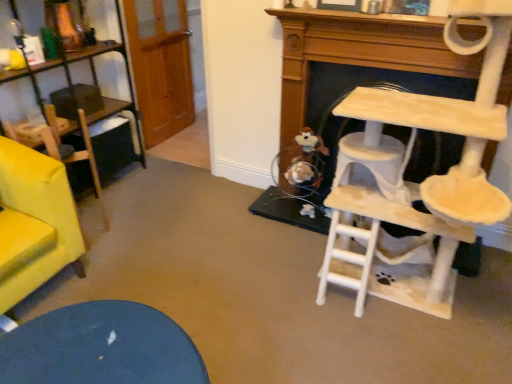
Question: Can you confirm if brown plush toy at lower center is taller than velvet yellow armchair at left?

Choices:
 (A) yes
 (B) no

Answer: (B)

Question: From a real-world perspective, is brown plush toy at lower center over velvet yellow armchair at left?

Choices:
 (A) no
 (B) yes

Answer: (B)

Question: Considering the relative positions of brown plush toy at lower center and velvet yellow armchair at left in the image provided, is brown plush toy at lower center to the right of velvet yellow armchair at left from the viewer's perspective?

Choices:
 (A) yes
 (B) no

Answer: (A)

Question: Is brown plush toy at lower center thinner than velvet yellow armchair at left?

Choices:
 (A) no
 (B) yes

Answer: (B)

Question: From the image's perspective, is brown plush toy at lower center located above velvet yellow armchair at left?

Choices:
 (A) yes
 (B) no

Answer: (A)

Question: Does brown plush toy at lower center come behind velvet yellow armchair at left?

Choices:
 (A) yes
 (B) no

Answer: (A)

Question: From the image's perspective, would you say beige wooden cat tree at right is shown under velvet yellow armchair at left?

Choices:
 (A) yes
 (B) no

Answer: (B)

Question: Considering the relative sizes of beige wooden cat tree at right and velvet yellow armchair at left in the image provided, is beige wooden cat tree at right shorter than velvet yellow armchair at left?

Choices:
 (A) no
 (B) yes

Answer: (A)

Question: Is beige wooden cat tree at right wider than velvet yellow armchair at left?

Choices:
 (A) no
 (B) yes

Answer: (B)

Question: Can velvet yellow armchair at left be found inside beige wooden cat tree at right?

Choices:
 (A) no
 (B) yes

Answer: (A)

Question: Are beige wooden cat tree at right and velvet yellow armchair at left beside each other?

Choices:
 (A) no
 (B) yes

Answer: (A)

Question: From the image's perspective, is beige wooden cat tree at right over velvet yellow armchair at left?

Choices:
 (A) no
 (B) yes

Answer: (B)

Question: Is beige wooden cat tree at right thinner than brown plush toy at lower center?

Choices:
 (A) yes
 (B) no

Answer: (B)